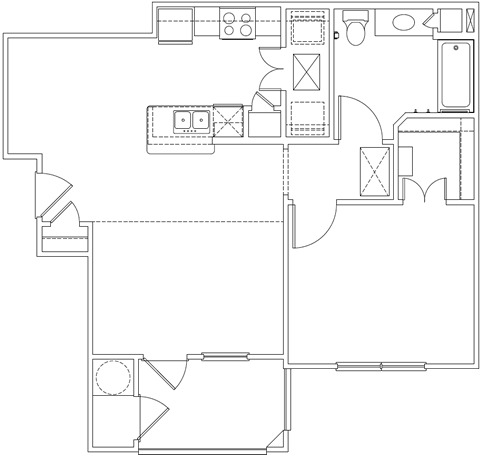
Find the location of `fridge`. fridge is located at coordinates (227, 114).